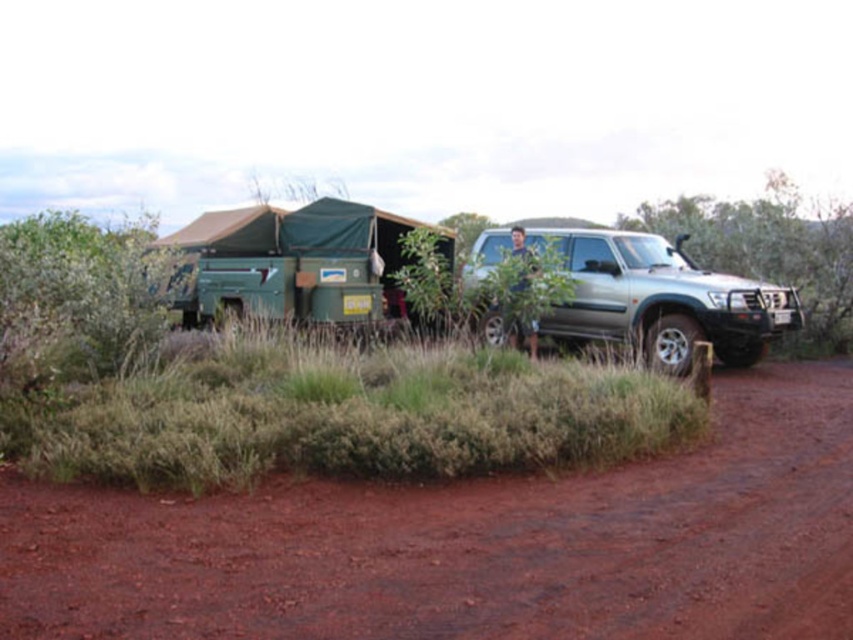
Is silver metallic jeep at right closer to the viewer compared to green leafy bush at right?

Yes.

Is silver metallic jeep at right taller than green leafy bush at right?

No, silver metallic jeep at right is not taller than green leafy bush at right.

Between point (677, 348) and point (836, 282), which one is positioned in front?

Point (677, 348)

You are a GUI agent. You are given a task and a screenshot of the screen. Output one action in this format:
    pyautogui.click(x=<x>, y=<y>)
    Task: Click on the silver metallic jeep at right
    The image size is (853, 640).
    Given the screenshot: What is the action you would take?
    (660, 298)

Is red clay dirt track at lower center thinner than silver metallic jeep at right?

Incorrect, red clay dirt track at lower center's width is not less than silver metallic jeep at right's.

Does red clay dirt track at lower center appear under silver metallic jeep at right?

Indeed, red clay dirt track at lower center is positioned under silver metallic jeep at right.

Image resolution: width=853 pixels, height=640 pixels. What are the coordinates of `red clay dirt track at lower center` in the screenshot? It's located at (471, 545).

Image resolution: width=853 pixels, height=640 pixels. What do you see at coordinates (471, 545) in the screenshot? I see `red clay dirt track at lower center` at bounding box center [471, 545].

Is point (437, 484) more distant than point (808, 282)?

No.

This screenshot has width=853, height=640. I want to click on red clay dirt track at lower center, so click(471, 545).